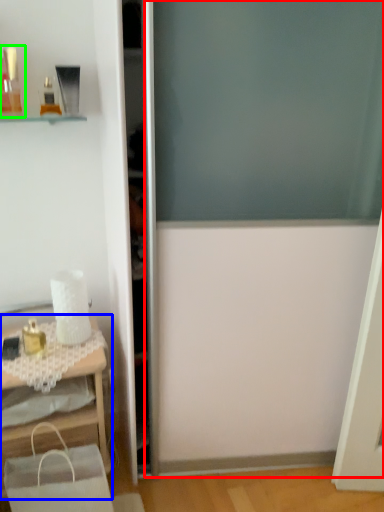
Question: Considering the real-world distances, which object is closest to screen door (highlighted by a red box)? table (highlighted by a blue box) or toiletry (highlighted by a green box).

Choices:
 (A) table
 (B) toiletry

Answer: (A)